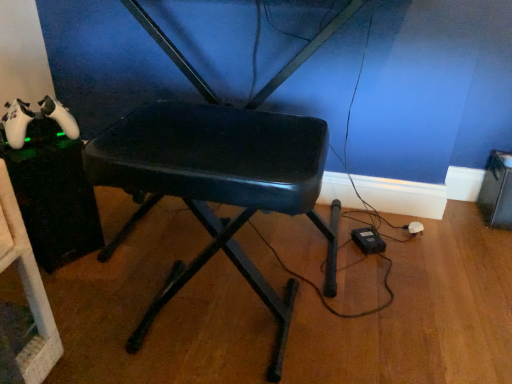
At what (x,y) coordinates should I click in order to perform the action: click on vacant space in matte black stool at center (from a real-world perspective). Please return your answer as a coordinate pair (x, y). Image resolution: width=512 pixels, height=384 pixels. Looking at the image, I should click on (211, 329).